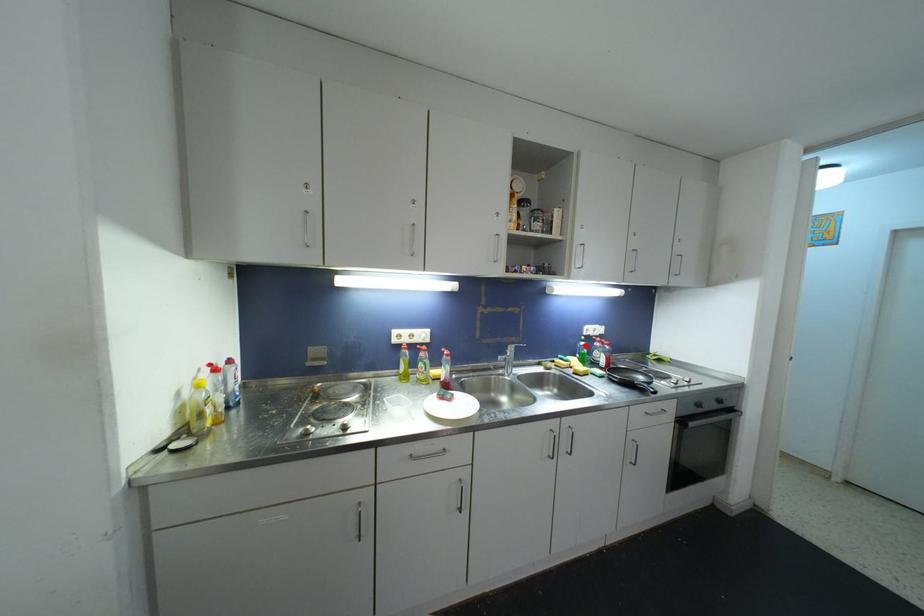
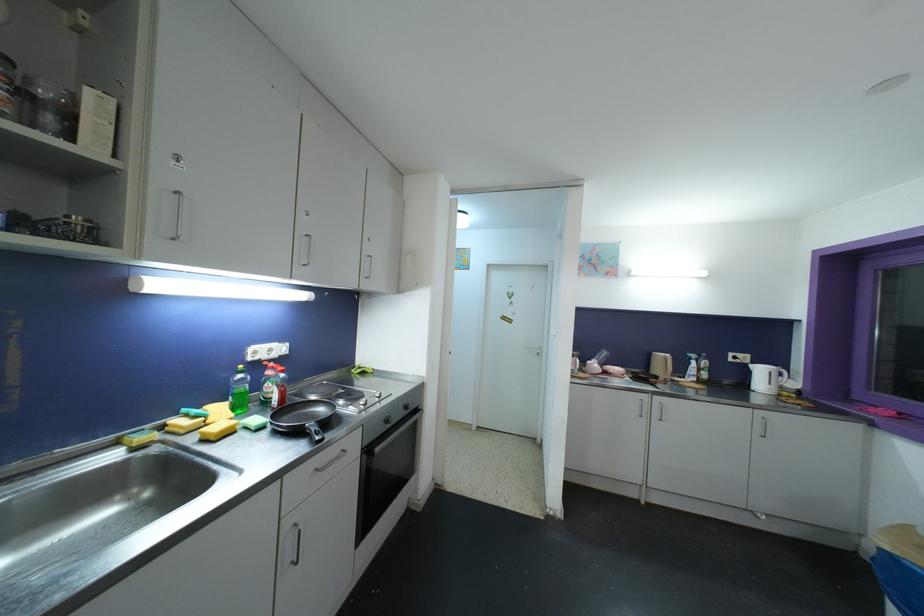
Locate, in the second image, the point that corresponds to the highlighted location in the first image.

(244, 379)